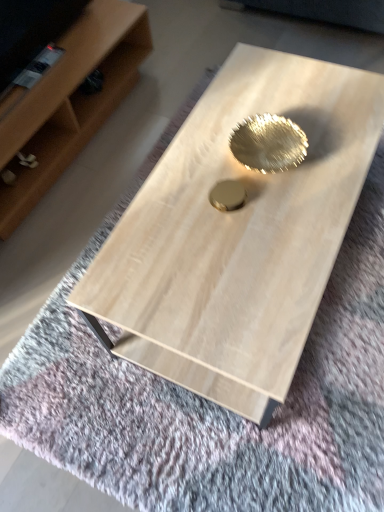
Question: Does light wood shelf at upper left appear on the right side of light wood coffee table at center?

Choices:
 (A) yes
 (B) no

Answer: (B)

Question: From the image's perspective, is light wood shelf at upper left under light wood coffee table at center?

Choices:
 (A) yes
 (B) no

Answer: (B)

Question: Can you confirm if light wood shelf at upper left is bigger than light wood coffee table at center?

Choices:
 (A) yes
 (B) no

Answer: (B)

Question: Is there a large distance between light wood shelf at upper left and light wood coffee table at center?

Choices:
 (A) yes
 (B) no

Answer: (B)

Question: Does light wood shelf at upper left have a greater width compared to light wood coffee table at center?

Choices:
 (A) no
 (B) yes

Answer: (A)

Question: Would you say light wood shelf at upper left contains light wood coffee table at center?

Choices:
 (A) yes
 (B) no

Answer: (B)

Question: Considering the relative sizes of light wood coffee table at center and light wood shelf at upper left in the image provided, is light wood coffee table at center bigger than light wood shelf at upper left?

Choices:
 (A) yes
 (B) no

Answer: (A)

Question: Is light wood shelf at upper left located within light wood coffee table at center?

Choices:
 (A) yes
 (B) no

Answer: (B)

Question: Considering the relative sizes of light wood coffee table at center and light wood shelf at upper left in the image provided, is light wood coffee table at center taller than light wood shelf at upper left?

Choices:
 (A) yes
 (B) no

Answer: (A)

Question: From the image's perspective, would you say light wood coffee table at center is positioned over light wood shelf at upper left?

Choices:
 (A) yes
 (B) no

Answer: (B)

Question: Can you confirm if light wood coffee table at center is positioned to the left of light wood shelf at upper left?

Choices:
 (A) no
 (B) yes

Answer: (A)

Question: Does light wood coffee table at center have a lesser height compared to light wood shelf at upper left?

Choices:
 (A) yes
 (B) no

Answer: (B)

Question: Is light wood coffee table at center situated inside light wood shelf at upper left or outside?

Choices:
 (A) outside
 (B) inside

Answer: (A)